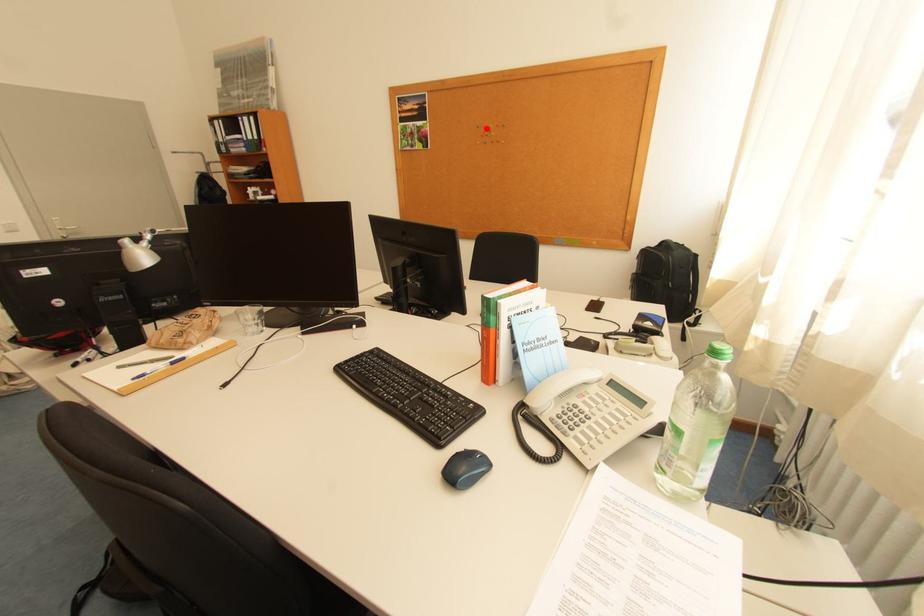
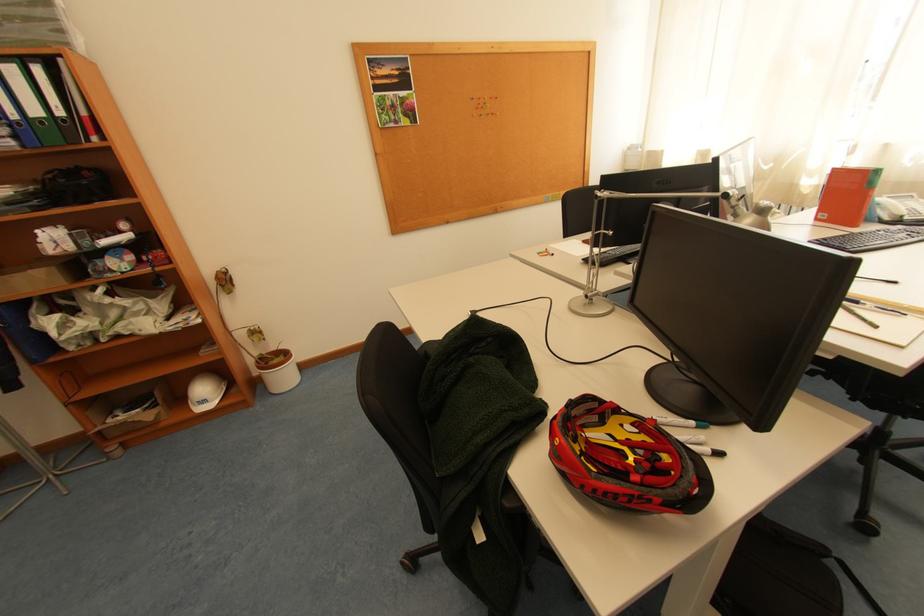
Where in the second image is the point corresponding to the highlighted location from the first image?

(480, 100)